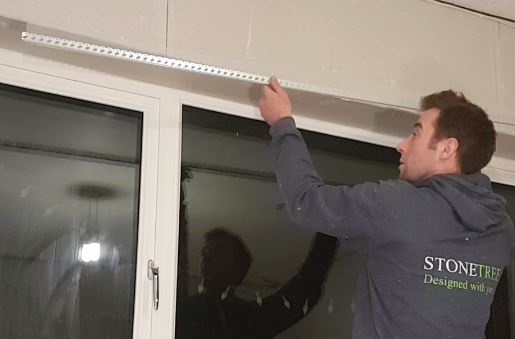
Where is `place you would hold to open the window`? place you would hold to open the window is located at coordinates (157, 285).